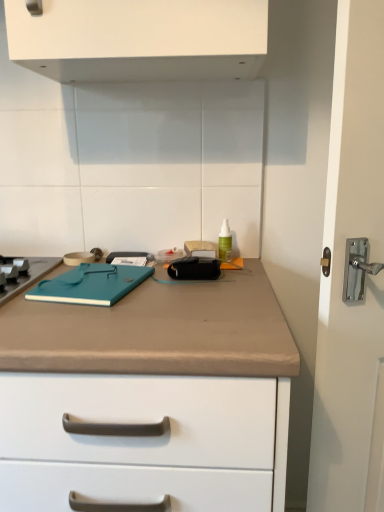
Identify the location of unoccupied area in front of teal matte notebook at center. This screenshot has height=512, width=384. (91, 325).